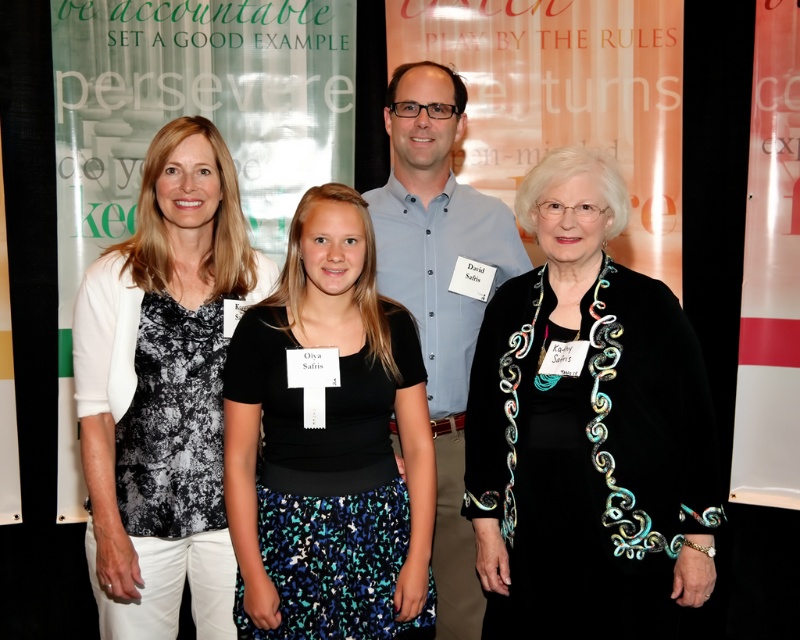
Is black jersey at center further to the viewer compared to black textured dress at center?

Yes, it is behind black textured dress at center.

Which of these two, black jersey at center or black textured dress at center, stands shorter?

black jersey at center is shorter.

Between point (252, 408) and point (594, 428), which one is positioned in front?

Positioned in front is point (594, 428).

Image resolution: width=800 pixels, height=640 pixels. What are the coordinates of `black jersey at center` in the screenshot? It's located at (329, 445).

Between black beaded necklace at right and light blue button-down shirt at center, which one is positioned lower?

black beaded necklace at right

Can you confirm if black beaded necklace at right is positioned above light blue button-down shirt at center?

No.

Which is in front, point (644, 541) or point (480, 609)?

Point (644, 541)

Find the location of a particular element. black beaded necklace at right is located at coordinates [x=588, y=429].

Which of these two, black textured dress at center or light blue button-down shirt at center, stands shorter?

black textured dress at center

Is point (476, 531) positioned after point (416, 259)?

No.

The image size is (800, 640). What do you see at coordinates (572, 227) in the screenshot?
I see `black textured dress at center` at bounding box center [572, 227].

At what (x,y) coordinates should I click in order to perform the action: click on black textured dress at center. Please return your answer as a coordinate pair (x, y). This screenshot has height=640, width=800. Looking at the image, I should click on (572, 227).